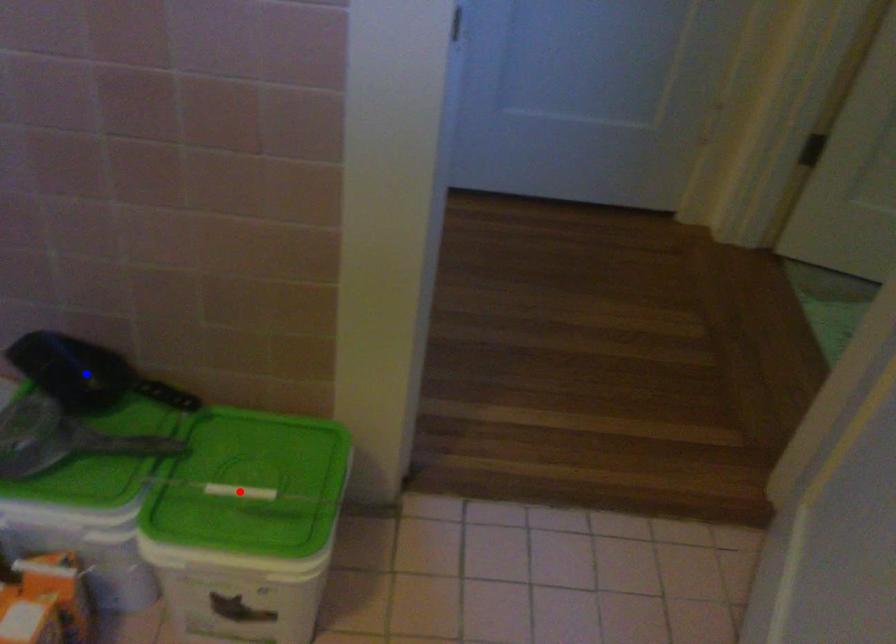
Question: Two points are marked on the image. Which point is closer to the camera?

Choices:
 (A) Blue point is closer.
 (B) Red point is closer.

Answer: (B)